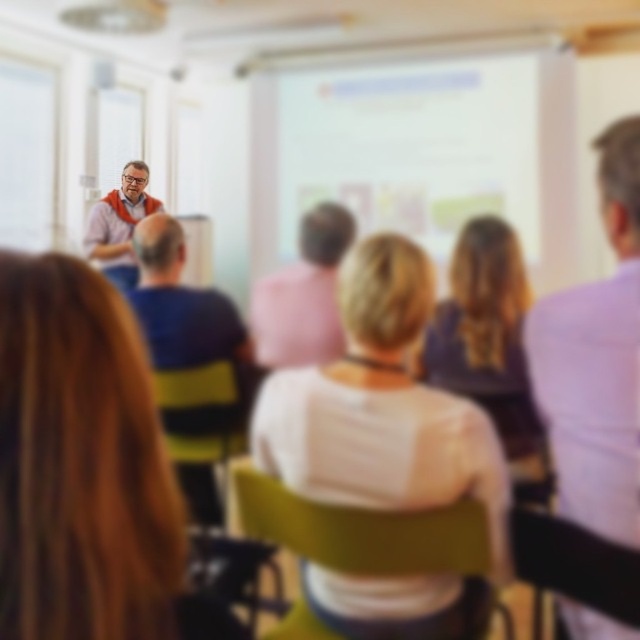
Question: Which of the following is the closest to the observer?

Choices:
 (A) green fabric chair at center
 (B) wooden chair at lower right

Answer: (B)

Question: Which object appears closest to the camera in this image?

Choices:
 (A) orange fabric at upper left
 (B) green fabric chair at center
 (C) blonde hair at lower left
 (D) white matte shirt at center

Answer: (C)

Question: From the image, what is the correct spatial relationship of blonde hair at lower left in relation to white matte shirt at center?

Choices:
 (A) right
 (B) left

Answer: (B)

Question: Which object appears farthest from the camera in this image?

Choices:
 (A) white matte shirt at center
 (B) light purple shirt at right

Answer: (A)

Question: Does blonde hair at lower left have a smaller size compared to green fabric chair at center?

Choices:
 (A) no
 (B) yes

Answer: (B)

Question: Can you confirm if blonde hair at lower left is positioned to the left of pink fabric shirt at center?

Choices:
 (A) yes
 (B) no

Answer: (A)